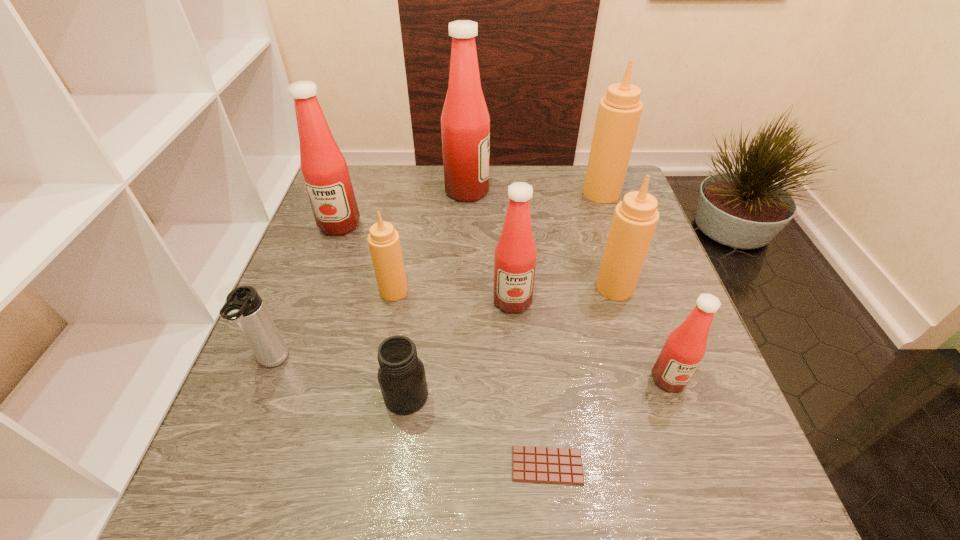
You are a GUI agent. You are given a task and a screenshot of the screen. Output one action in this format:
    pyautogui.click(x=<x>, y=<y>)
    Task: Click on the fifth condiment from right to left
    
    Given the screenshot: What is the action you would take?
    pyautogui.click(x=465, y=122)

Find the location of a particular element. This screenshot has height=540, width=960. the tallest condiment is located at coordinates pyautogui.click(x=465, y=122).

At what (x,y) coordinates should I click in order to perform the action: click on the leftmost red condiment. Please return your answer as a coordinate pair (x, y). This screenshot has width=960, height=540. Looking at the image, I should click on (324, 169).

Where is `the second biggest red condiment`? the second biggest red condiment is located at coordinates (324, 169).

The height and width of the screenshot is (540, 960). In order to click on the farthest tan condiment in this screenshot , I will do `click(619, 111)`.

Find the location of a particular element. Image resolution: width=960 pixels, height=540 pixels. the second biggest tan condiment is located at coordinates (635, 218).

Locate an element on the screen. The height and width of the screenshot is (540, 960). the third farthest red condiment is located at coordinates (515, 255).

Identify the location of the third biggest red condiment. This screenshot has height=540, width=960. (515, 255).

Identify the location of the second condiment from left to right. The height and width of the screenshot is (540, 960). (384, 244).

I want to click on the smallest tan condiment, so click(384, 244).